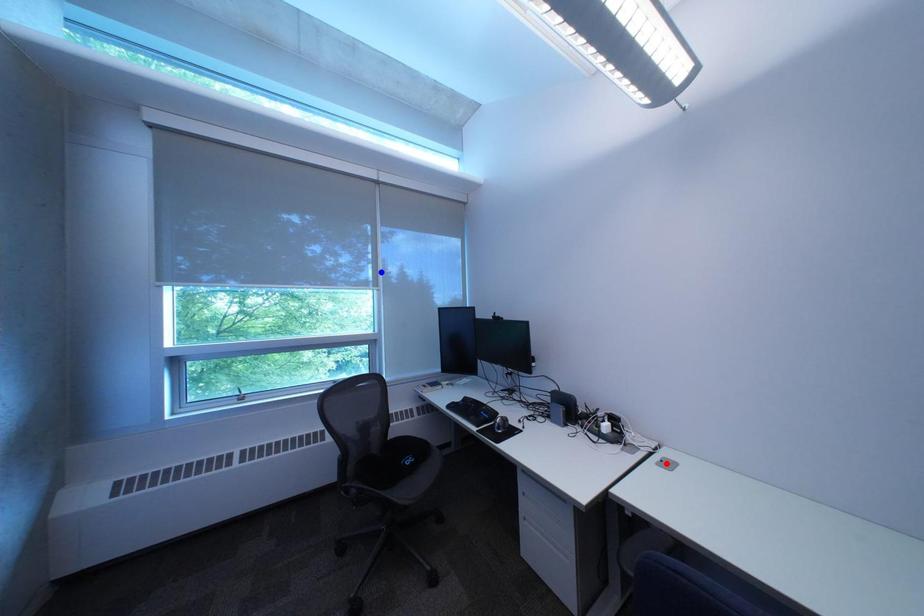
Question: Two points are marked on the image. Which point is closer to the camera?

Choices:
 (A) Blue point is closer.
 (B) Red point is closer.

Answer: (B)